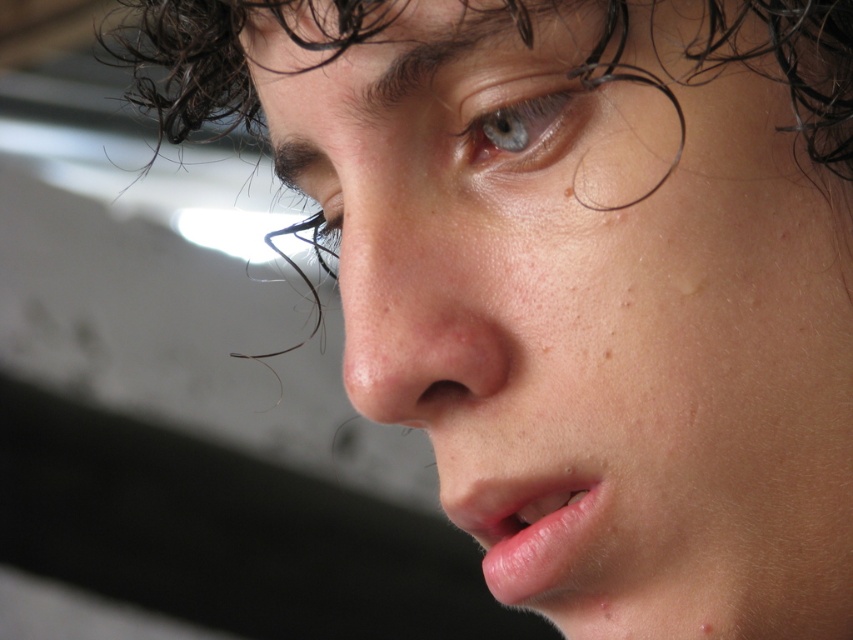
Question: Is smooth skin face at center to the left of pink glossy lips at lower center from the viewer's perspective?

Choices:
 (A) no
 (B) yes

Answer: (A)

Question: Which point is farther to the camera?

Choices:
 (A) dark curly hair at upper center
 (B) brown matte freckle at lower right
 (C) pink glossy lips at lower center
 (D) smooth skin face at center

Answer: (B)

Question: Does blue glossy eye at upper center have a lesser width compared to brown matte freckle at lower right?

Choices:
 (A) no
 (B) yes

Answer: (A)

Question: Which object is farther from the camera taking this photo?

Choices:
 (A) smooth skin nose at center
 (B) dark curly hair at upper center
 (C) pink glossy lips at lower center

Answer: (C)

Question: Which object is farther from the camera taking this photo?

Choices:
 (A) smooth skin nose at center
 (B) dark curly hair at upper center
 (C) blue glossy eye at upper center

Answer: (A)

Question: Does smooth skin face at center have a lesser width compared to pink glossy lips at lower center?

Choices:
 (A) yes
 (B) no

Answer: (B)